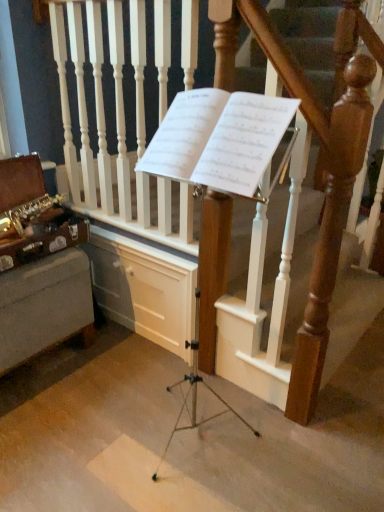
Question: In the image, is white paper at center positioned in front of or behind wooden at center?

Choices:
 (A) behind
 (B) front

Answer: (B)

Question: From a real-world perspective, is white paper at center above or below wooden at center?

Choices:
 (A) below
 (B) above

Answer: (B)

Question: Considering the real-world distances, which object is farthest from the wooden at center?

Choices:
 (A) gold brass saxophone at left
 (B) white paper at center

Answer: (A)

Question: Which is nearer to the white paper at center?

Choices:
 (A) gold brass saxophone at left
 (B) wooden at center

Answer: (B)